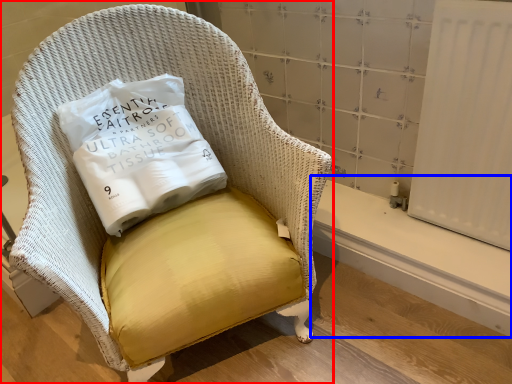
Question: Among these objects, which one is farthest to the camera, chair (highlighted by a red box) or window sill (highlighted by a blue box)?

Choices:
 (A) chair
 (B) window sill

Answer: (B)